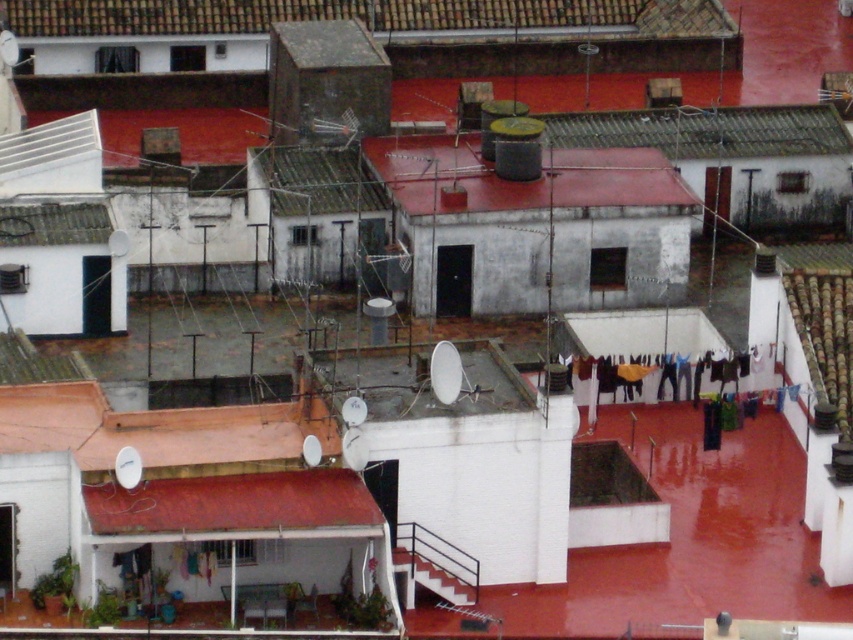
Question: Which object is the farthest from the rusty corrugated metal roof at upper center?

Choices:
 (A) red matte roof at center
 (B) smooth red awning at center

Answer: (B)

Question: In this image, where is smooth red awning at center located relative to rusty corrugated metal roof at upper center?

Choices:
 (A) above
 (B) below

Answer: (B)

Question: Which point is closer to the camera taking this photo?

Choices:
 (A) (660, 141)
 (B) (265, 477)

Answer: (B)

Question: Does red matte roof at center have a smaller size compared to rusty corrugated metal roof at upper center?

Choices:
 (A) no
 (B) yes

Answer: (B)

Question: Observing the image, what is the correct spatial positioning of red matte roof at center in reference to rusty corrugated metal roof at upper center?

Choices:
 (A) right
 (B) left

Answer: (B)

Question: Based on their relative distances, which object is nearer to the smooth red awning at center?

Choices:
 (A) red matte roof at center
 (B) rusty corrugated metal roof at upper center

Answer: (A)